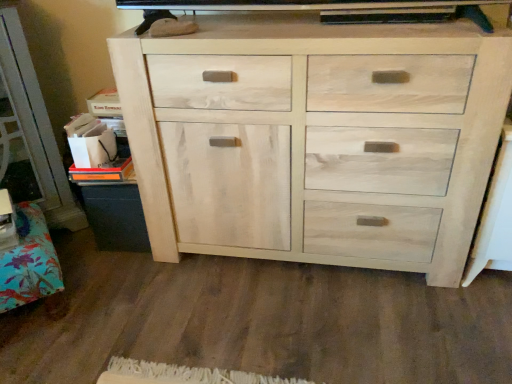
Question: Which is correct: natural wood cabinet at lower left is inside natural wood cabinet at center, or outside of it?

Choices:
 (A) outside
 (B) inside

Answer: (A)

Question: Considering the positions of natural wood cabinet at lower left and natural wood cabinet at center in the image, is natural wood cabinet at lower left wider or thinner than natural wood cabinet at center?

Choices:
 (A) thin
 (B) wide

Answer: (B)

Question: Based on their sizes in the image, would you say natural wood cabinet at lower left is bigger or smaller than natural wood cabinet at center?

Choices:
 (A) big
 (B) small

Answer: (B)

Question: Considering the relative positions of natural wood cabinet at center and natural wood cabinet at lower left in the image provided, is natural wood cabinet at center to the left or to the right of natural wood cabinet at lower left?

Choices:
 (A) left
 (B) right

Answer: (B)

Question: From the image's perspective, is natural wood cabinet at center located above or below natural wood cabinet at lower left?

Choices:
 (A) above
 (B) below

Answer: (A)

Question: From a real-world perspective, relative to natural wood cabinet at lower left, is natural wood cabinet at center vertically above or below?

Choices:
 (A) below
 (B) above

Answer: (B)

Question: In terms of height, does natural wood cabinet at center look taller or shorter compared to natural wood cabinet at lower left?

Choices:
 (A) short
 (B) tall

Answer: (B)